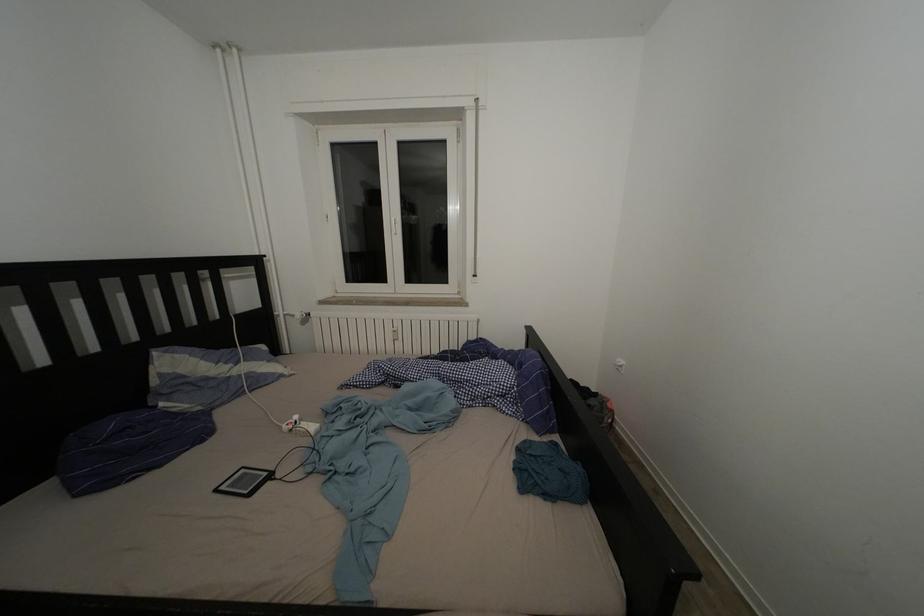
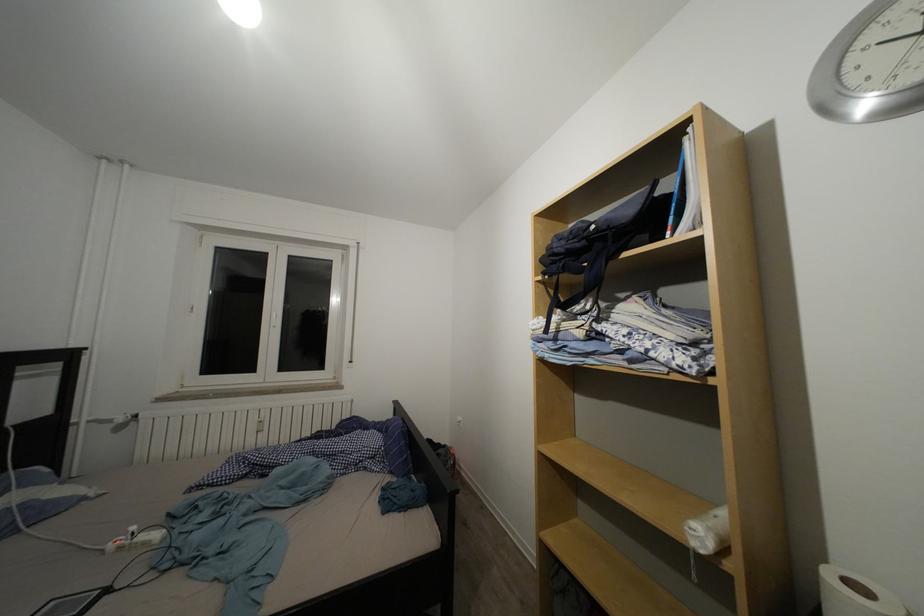
In the second image, find the point that corresponds to point 249,477 in the first image.

(61, 610)